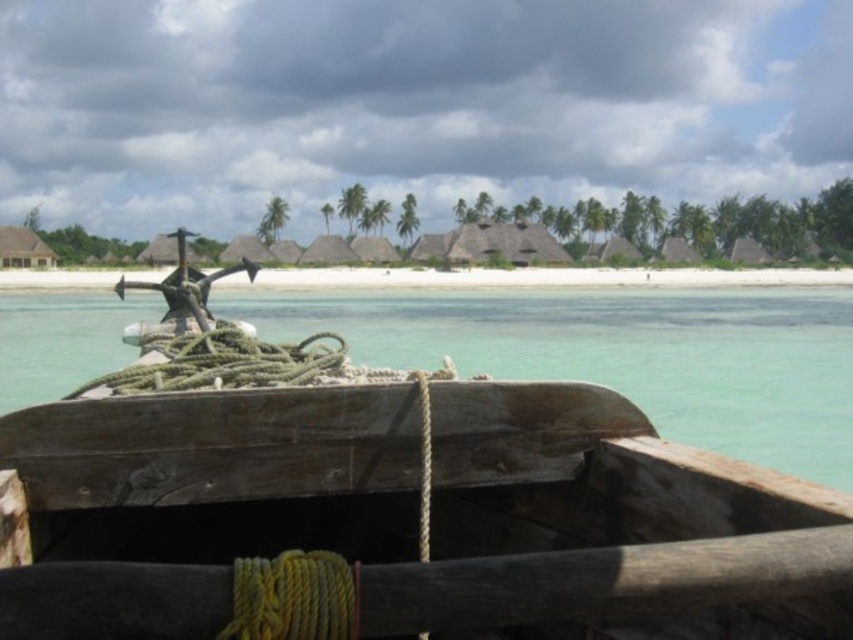
Question: Which of the following is the farthest from the observer?

Choices:
 (A) wooden boat at center
 (B) white sand beach at center

Answer: (B)

Question: Is wooden boat at center further to the viewer compared to white sand beach at center?

Choices:
 (A) no
 (B) yes

Answer: (A)

Question: Can you confirm if wooden boat at center is wider than white sand beach at center?

Choices:
 (A) no
 (B) yes

Answer: (A)

Question: Which point is closer to the camera?

Choices:
 (A) white sand beach at center
 (B) wooden boat at center

Answer: (B)

Question: Is wooden boat at center behind white sand beach at center?

Choices:
 (A) yes
 (B) no

Answer: (B)